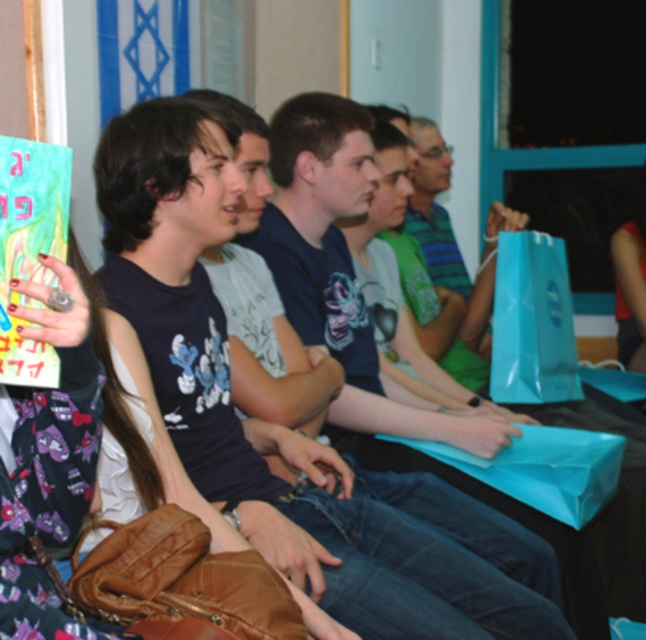
Question: Considering the relative positions of dark blue t-shirt at center and blue paper bag at center in the image provided, where is dark blue t-shirt at center located with respect to blue paper bag at center?

Choices:
 (A) left
 (B) right

Answer: (A)

Question: Which object is closer to the camera taking this photo?

Choices:
 (A) blue paper bag at center
 (B) dark blue t-shirt at center

Answer: (B)

Question: Is dark blue t-shirt at center to the left of blue paper bag at center from the viewer's perspective?

Choices:
 (A) no
 (B) yes

Answer: (B)

Question: Which point appears closest to the camera in this image?

Choices:
 (A) (194, 244)
 (B) (508, 380)

Answer: (A)

Question: Does dark blue t-shirt at center appear under blue paper bag at center?

Choices:
 (A) no
 (B) yes

Answer: (B)